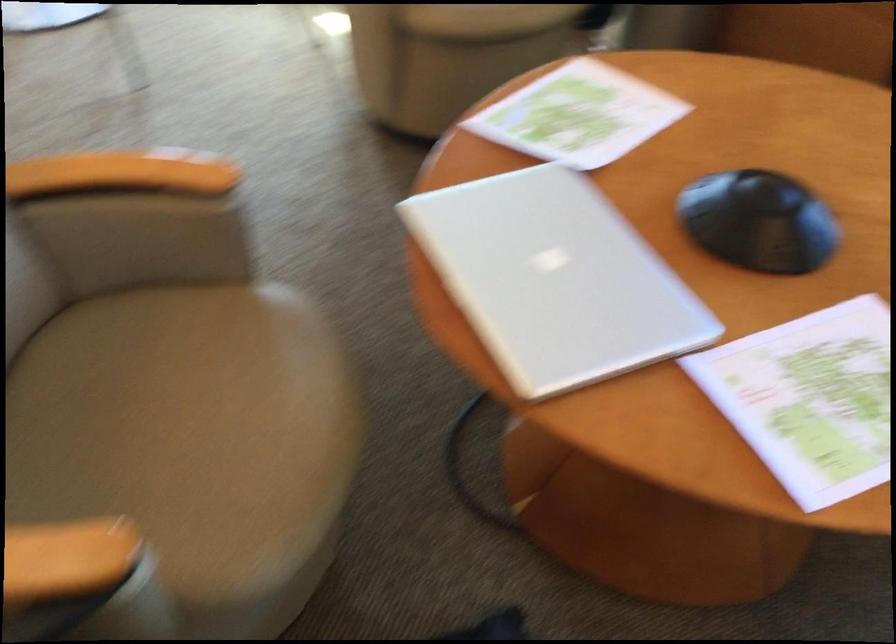
What do you see at coordinates (66, 558) in the screenshot?
I see `the brown chair armrest` at bounding box center [66, 558].